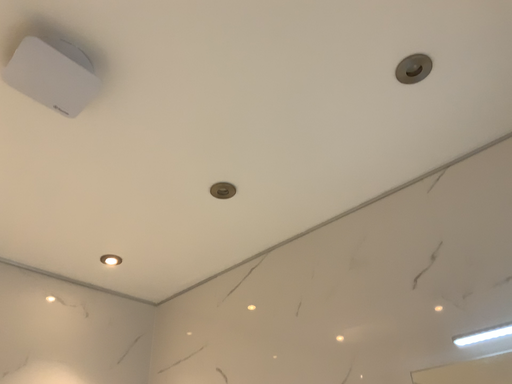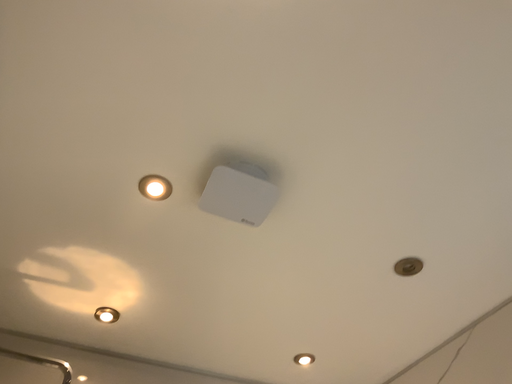
Question: How did the camera likely rotate when shooting the video?

Choices:
 (A) rotated downward
 (B) rotated upward

Answer: (B)